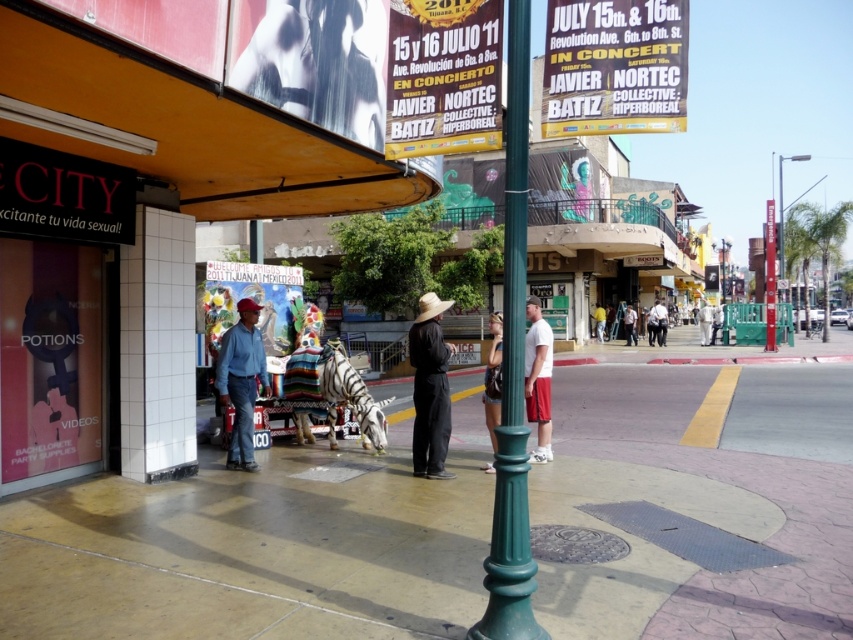
Looking at this image, you are standing on the smooth concrete sidewalk at center. If you look directly ahead, which direction would you face relative to the green lamppost?

→ The smooth concrete sidewalk at center is located at point (256, 548), so facing directly ahead from there would align you with the green lamppost in the foreground.

You are a tourist in this Mexican street scene and want to take a photo of both the yellow paper poster at upper center and the denim jacket at center. Which object should you point your camera towards first to include both in the frame?

The yellow paper poster at upper center is to the left of the denim jacket at center, so you should point your camera towards the yellow paper poster at upper center first to include both in the frame.